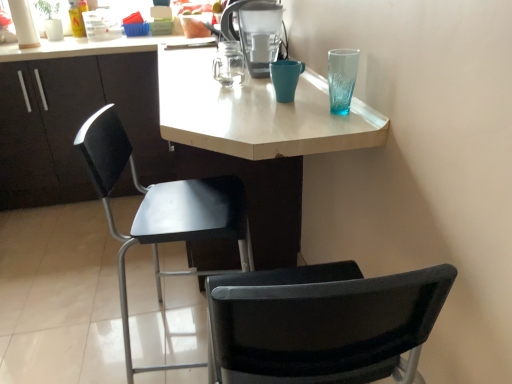
Question: Can you confirm if matte black cabinet at left is smaller than teal ceramic mug at upper center?

Choices:
 (A) no
 (B) yes

Answer: (A)

Question: From the image's perspective, is matte black cabinet at left on teal ceramic mug at upper center?

Choices:
 (A) yes
 (B) no

Answer: (A)

Question: Is matte black cabinet at left beside teal ceramic mug at upper center?

Choices:
 (A) yes
 (B) no

Answer: (B)

Question: Is matte black cabinet at left shorter than teal ceramic mug at upper center?

Choices:
 (A) no
 (B) yes

Answer: (A)

Question: Does matte black cabinet at left have a larger size compared to teal ceramic mug at upper center?

Choices:
 (A) no
 (B) yes

Answer: (B)

Question: From a real-world perspective, is matte black cabinet at left located beneath teal ceramic mug at upper center?

Choices:
 (A) yes
 (B) no

Answer: (A)

Question: From the image's perspective, would you say matte plastic water filter at upper center is shown under matte black cabinet at left?

Choices:
 (A) no
 (B) yes

Answer: (A)

Question: Does matte plastic water filter at upper center have a smaller size compared to matte black cabinet at left?

Choices:
 (A) yes
 (B) no

Answer: (A)

Question: Is matte plastic water filter at upper center closer to camera compared to matte black cabinet at left?

Choices:
 (A) no
 (B) yes

Answer: (B)

Question: Is matte plastic water filter at upper center thinner than matte black cabinet at left?

Choices:
 (A) yes
 (B) no

Answer: (A)

Question: Does matte plastic water filter at upper center have a lesser height compared to matte black cabinet at left?

Choices:
 (A) no
 (B) yes

Answer: (B)

Question: Is matte plastic water filter at upper center looking in the opposite direction of matte black cabinet at left?

Choices:
 (A) yes
 (B) no

Answer: (B)

Question: Does black plastic chair at center have a lesser width compared to matte plastic water filter at upper center?

Choices:
 (A) no
 (B) yes

Answer: (A)